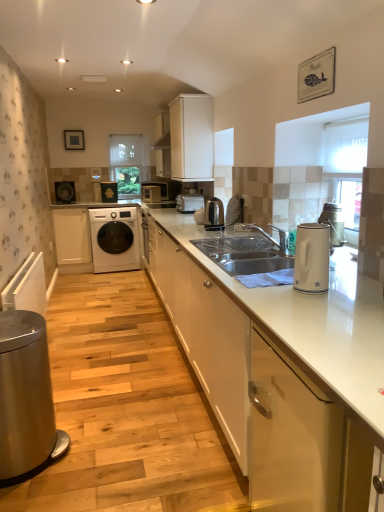
The height and width of the screenshot is (512, 384). I want to click on vacant area to the right of satin nickel kettle at center, which is the fourth appliance in left-to-right order, so click(x=234, y=228).